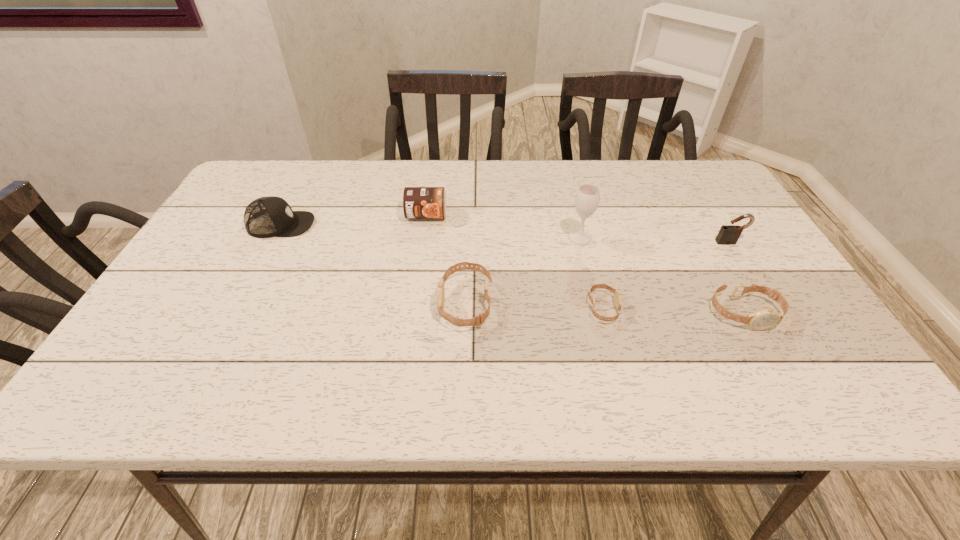
Where is `the second closest watch to the second object from left to right`? Image resolution: width=960 pixels, height=540 pixels. the second closest watch to the second object from left to right is located at coordinates (617, 294).

Identify the location of free location that satisfies the following two spatial constraints: 1. with the keyhole on the front of the padlock; 2. on the face of the fifth object from right to left. This screenshot has width=960, height=540. (767, 303).